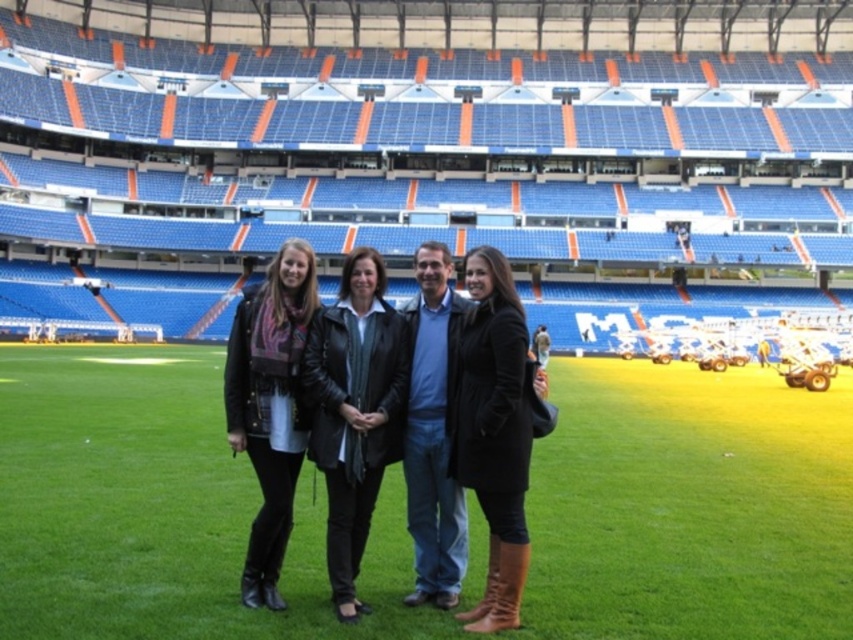
Question: Can you confirm if black leather jacket at center is wider than matte black leather jacket at center?

Choices:
 (A) no
 (B) yes

Answer: (A)

Question: Which object is the closest to the black leather coat at center?

Choices:
 (A) black leather jacket at center
 (B) green grass at center

Answer: (A)

Question: Based on their relative distances, which object is nearer to the black leather jacket at center?

Choices:
 (A) green grass at center
 (B) matte black leather jacket at center
 (C) black leather coat at center

Answer: (C)

Question: Is green grass at center below black leather coat at center?

Choices:
 (A) yes
 (B) no

Answer: (A)

Question: Which of these objects is positioned closest to the black leather jacket at center?

Choices:
 (A) green grass at center
 (B) black leather coat at center

Answer: (B)

Question: Can you confirm if black leather coat at center is smaller than matte black leather jacket at center?

Choices:
 (A) no
 (B) yes

Answer: (B)